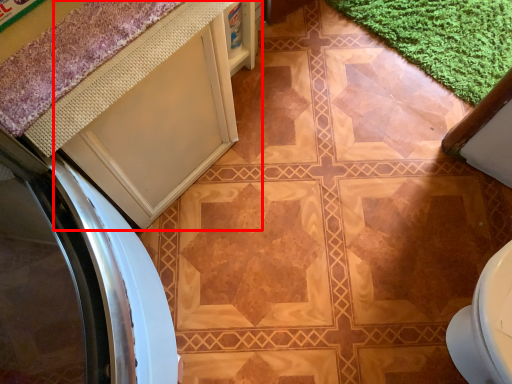
Question: From the image's perspective, what is the correct spatial positioning of cabinetry (annotated by the red box) in reference to bath mat?

Choices:
 (A) below
 (B) above

Answer: (A)